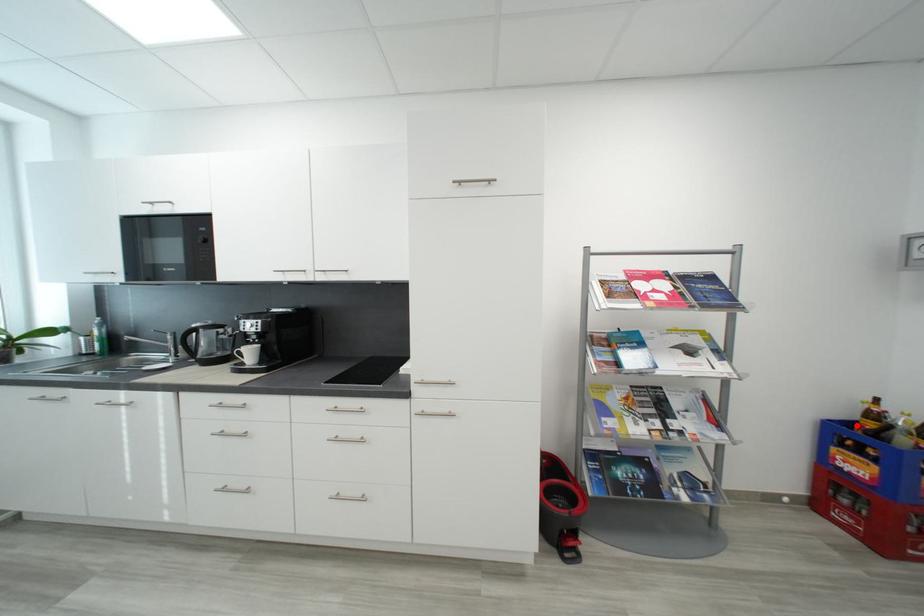
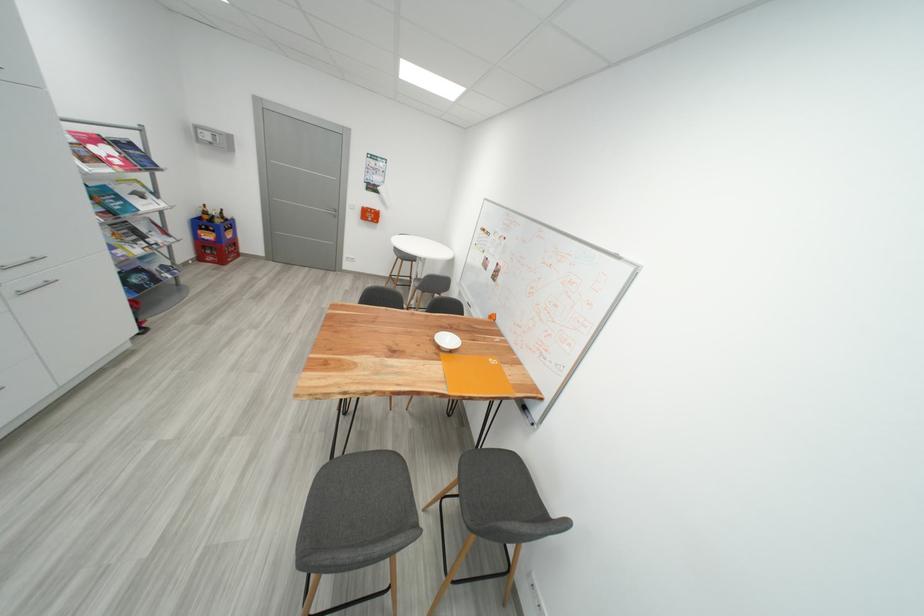
Question: I am providing you with two images of the same scene from different viewpoints. Image1 has a red point marked. In image2, the corresponding 3D location appears at what relative position? Reply with the corresponding letter.

Choices:
 (A) Closer
 (B) Farther

Answer: (A)